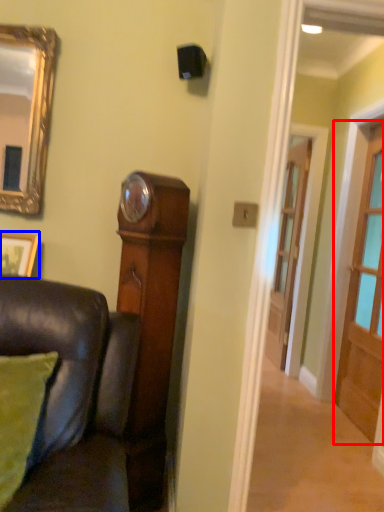
Question: Among these objects, which one is nearest to the camera, door (highlighted by a red box) or picture frame (highlighted by a blue box)?

Choices:
 (A) door
 (B) picture frame

Answer: (B)